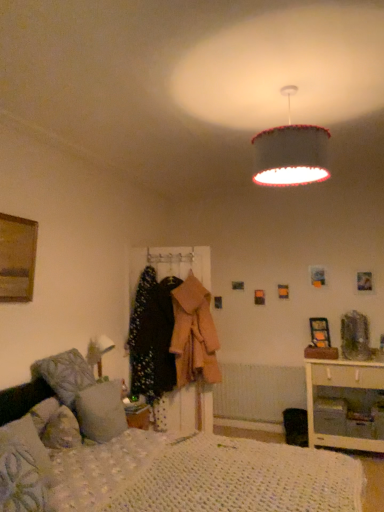
Question: Is white knitted mattress at lower center outside white wood nightstand at lower right?

Choices:
 (A) no
 (B) yes

Answer: (B)

Question: Can you confirm if white knitted mattress at lower center is wider than white wood nightstand at lower right?

Choices:
 (A) no
 (B) yes

Answer: (B)

Question: Considering the relative sizes of white knitted mattress at lower center and white wood nightstand at lower right in the image provided, is white knitted mattress at lower center smaller than white wood nightstand at lower right?

Choices:
 (A) yes
 (B) no

Answer: (A)

Question: Does white knitted mattress at lower center have a lesser height compared to white wood nightstand at lower right?

Choices:
 (A) yes
 (B) no

Answer: (A)

Question: From the image's perspective, is white knitted mattress at lower center located above white wood nightstand at lower right?

Choices:
 (A) no
 (B) yes

Answer: (B)

Question: Considering the relative positions of white knitted mattress at lower center and white wood nightstand at lower right in the image provided, is white knitted mattress at lower center in front of white wood nightstand at lower right?

Choices:
 (A) yes
 (B) no

Answer: (A)

Question: Could floral fabric coat at center, placed as the first clothing when sorted from left to right, be considered to be inside fluffy gray pillow at lower left, arranged as the second pillow when viewed from the front?

Choices:
 (A) yes
 (B) no

Answer: (B)

Question: From the image's perspective, is fluffy gray pillow at lower left, arranged as the second pillow when viewed from the front, on top of floral fabric coat at center, which is the 2th clothing in right-to-left order?

Choices:
 (A) no
 (B) yes

Answer: (A)

Question: Could you tell me if fluffy gray pillow at lower left, positioned as the 1th pillow in back-to-front order, is turned towards floral fabric coat at center, which is the 2th clothing in right-to-left order?

Choices:
 (A) no
 (B) yes

Answer: (A)

Question: Is fluffy gray pillow at lower left, positioned as the 1th pillow in back-to-front order, next to floral fabric coat at center, placed as the first clothing when sorted from left to right, and touching it?

Choices:
 (A) no
 (B) yes

Answer: (A)

Question: Is fluffy gray pillow at lower left, arranged as the second pillow when viewed from the front, further to camera compared to floral fabric coat at center, which is the 2th clothing in right-to-left order?

Choices:
 (A) yes
 (B) no

Answer: (B)

Question: Can you confirm if fluffy gray pillow at lower left, arranged as the second pillow when viewed from the front, is shorter than floral fabric coat at center, which is the 2th clothing in right-to-left order?

Choices:
 (A) yes
 (B) no

Answer: (A)

Question: Considering the relative sizes of wooden picture frame at right, the 2th picture frame when ordered from front to back, and white wood nightstand at lower right in the image provided, is wooden picture frame at right, the 2th picture frame when ordered from front to back, taller than white wood nightstand at lower right?

Choices:
 (A) yes
 (B) no

Answer: (B)